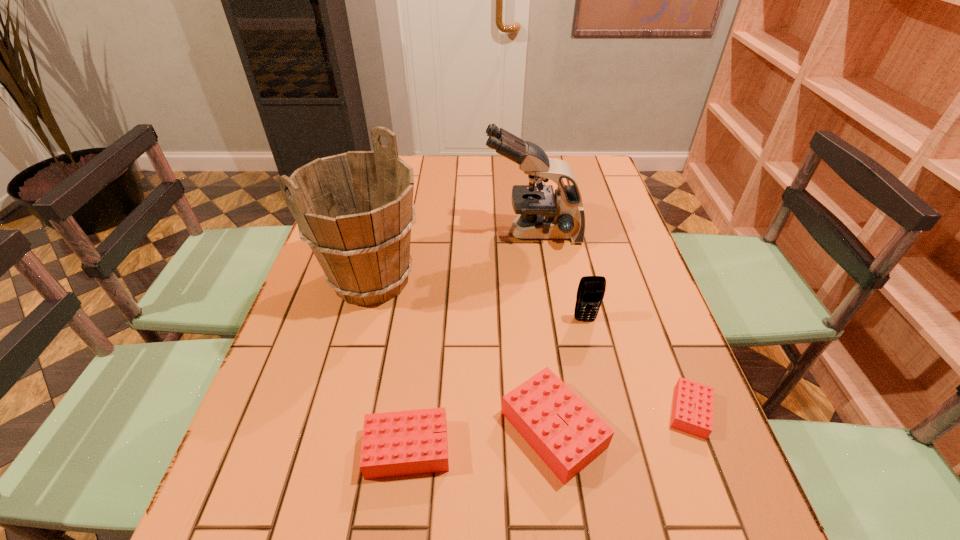
In the current image, all Legos are evenly spaced. To maintain this equal spacing, where should an additional Lego be placed on the left? Please point out a free spot. Please provide its 2D coordinates. Your answer should be formatted as a tuple, i.e. [(x, y)], where the tuple contains the x and y coordinates of a point satisfying the conditions above.

[(252, 469)]